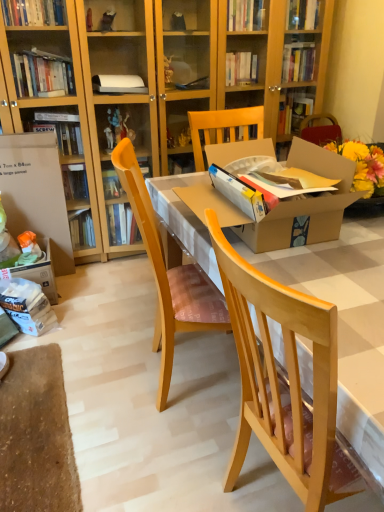
Question: In which direction should I rotate to look at natural wood chair at center, the 2th chair from the left?

Choices:
 (A) left
 (B) right

Answer: (B)

Question: Is natural wood chair at center, the 2th chair from the left, oriented away from wooden chair at center, the first chair in the left-to-right sequence?

Choices:
 (A) yes
 (B) no

Answer: (B)

Question: Can you confirm if natural wood chair at center, the 2th chair from the left, is taller than wooden chair at center, which ranks as the 2th chair in right-to-left order?

Choices:
 (A) no
 (B) yes

Answer: (B)

Question: Can you confirm if natural wood chair at center, arranged as the first chair when viewed from the right, is positioned to the right of wooden chair at center, which ranks as the 2th chair in right-to-left order?

Choices:
 (A) no
 (B) yes

Answer: (B)

Question: Could you tell me if natural wood chair at center, the 2th chair from the left, is turned towards wooden chair at center, which ranks as the 2th chair in right-to-left order?

Choices:
 (A) no
 (B) yes

Answer: (A)

Question: Is natural wood chair at center, the 2th chair from the left, wider than wooden chair at center, the first chair in the left-to-right sequence?

Choices:
 (A) no
 (B) yes

Answer: (B)

Question: From the image's perspective, is natural wood chair at center, arranged as the first chair when viewed from the right, located above wooden chair at center, the first chair in the left-to-right sequence?

Choices:
 (A) no
 (B) yes

Answer: (A)

Question: Is cardboard box at left touching wooden chair at center, the first chair in the left-to-right sequence?

Choices:
 (A) yes
 (B) no

Answer: (B)

Question: From a real-world perspective, is cardboard box at left located beneath wooden chair at center, the first chair in the left-to-right sequence?

Choices:
 (A) yes
 (B) no

Answer: (A)

Question: Can you confirm if cardboard box at left is wider than wooden chair at center, which ranks as the 2th chair in right-to-left order?

Choices:
 (A) yes
 (B) no

Answer: (B)

Question: Does cardboard box at left have a greater height compared to wooden chair at center, which ranks as the 2th chair in right-to-left order?

Choices:
 (A) yes
 (B) no

Answer: (B)

Question: Considering the relative positions of cardboard box at left and wooden chair at center, which ranks as the 2th chair in right-to-left order, in the image provided, is cardboard box at left to the left of wooden chair at center, which ranks as the 2th chair in right-to-left order, from the viewer's perspective?

Choices:
 (A) no
 (B) yes

Answer: (B)

Question: Is cardboard box at left at the right side of wooden chair at center, which ranks as the 2th chair in right-to-left order?

Choices:
 (A) no
 (B) yes

Answer: (A)

Question: From a real-world perspective, does wooden chair at center, the first chair in the left-to-right sequence, stand above natural wood chair at center, arranged as the first chair when viewed from the right?

Choices:
 (A) no
 (B) yes

Answer: (A)